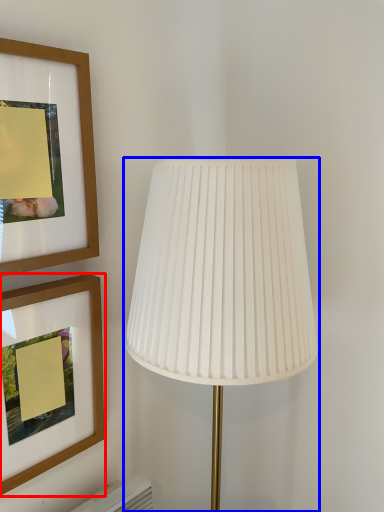
Question: Among these objects, which one is farthest to the camera, picture frame (highlighted by a red box) or lamp (highlighted by a blue box)?

Choices:
 (A) picture frame
 (B) lamp

Answer: (A)